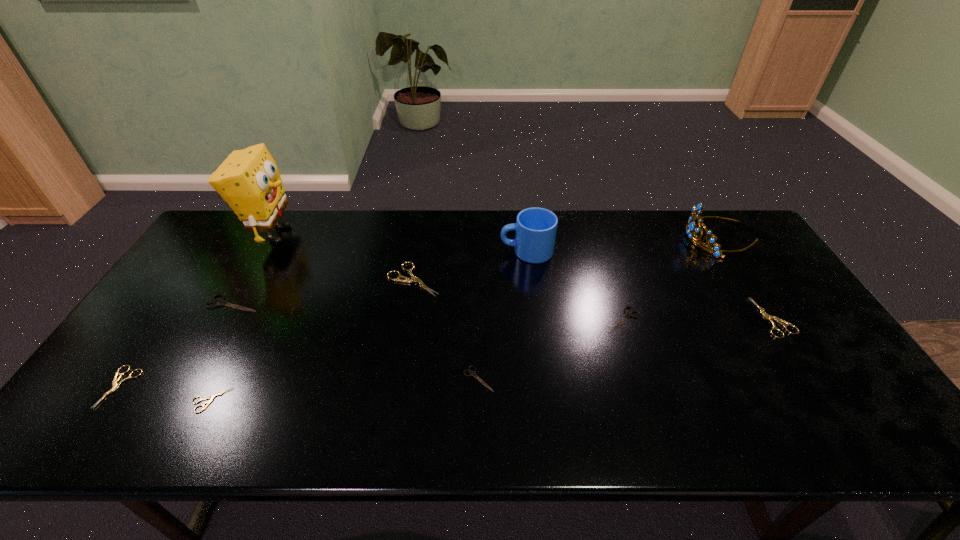
At what (x,y) coordinates should I click in order to perform the action: click on vacant area that lies between the gold tiara and the fourth shears from left to right. Please return your answer as a coordinate pair (x, y). The image size is (960, 540). Looking at the image, I should click on (566, 259).

This screenshot has width=960, height=540. Find the location of `blank region between the smallest beige shears and the mug`. blank region between the smallest beige shears and the mug is located at coordinates (369, 326).

This screenshot has width=960, height=540. I want to click on vacant space in between the leftmost black shears and the sixth shears from left to right, so click(428, 312).

Where is `vacant region between the leftmost black shears and the nearest black shears`? vacant region between the leftmost black shears and the nearest black shears is located at coordinates (356, 341).

Image resolution: width=960 pixels, height=540 pixels. I want to click on empty location between the fourth object from right to left and the biggest black shears, so (x=380, y=277).

You are a GUI agent. You are given a task and a screenshot of the screen. Output one action in this format:
    pyautogui.click(x=<x>, y=<y>)
    Task: Click on the unoccupied area between the leftmost object and the farthest beige shears
    
    Given the screenshot: What is the action you would take?
    pyautogui.click(x=267, y=333)

Identify which object is the nearest to the second biggest beige shears. Please provide its 2D coordinates. Your answer should be formatted as a tuple, i.e. [(x, y)], where the tuple contains the x and y coordinates of a point satisfying the conditions above.

[(691, 226)]

Identify the location of object that stands as the second closest to the smallest beige shears. The height and width of the screenshot is (540, 960). (220, 302).

Select which shears is the closest to the biggest beige shears. Please provide its 2D coordinates. Your answer should be formatted as a tuple, i.e. [(x, y)], where the tuple contains the x and y coordinates of a point satisfying the conditions above.

[(472, 373)]

Identify which shears is the sixth closest to the rightmost shears. Please provide its 2D coordinates. Your answer should be formatted as a tuple, i.e. [(x, y)], where the tuple contains the x and y coordinates of a point satisfying the conditions above.

[(115, 385)]